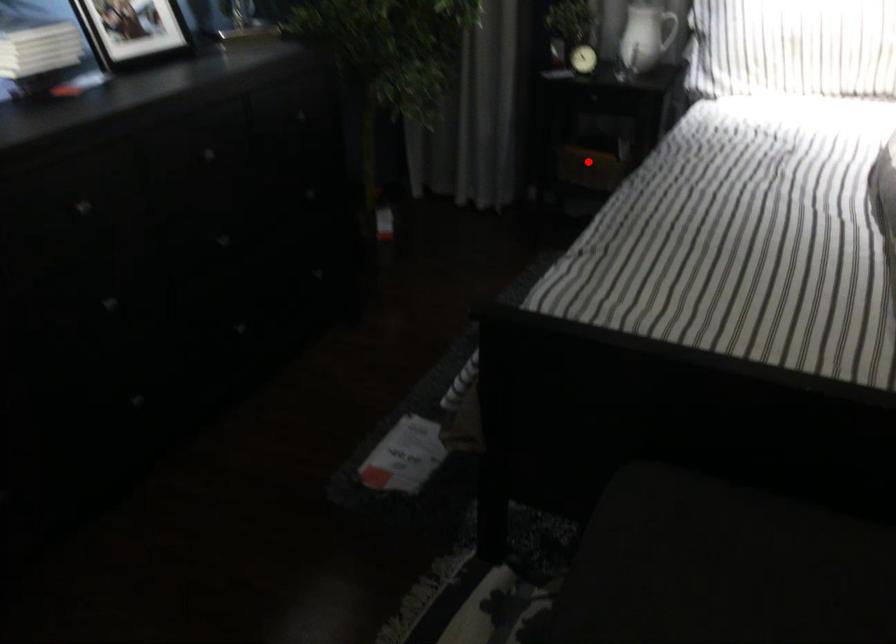
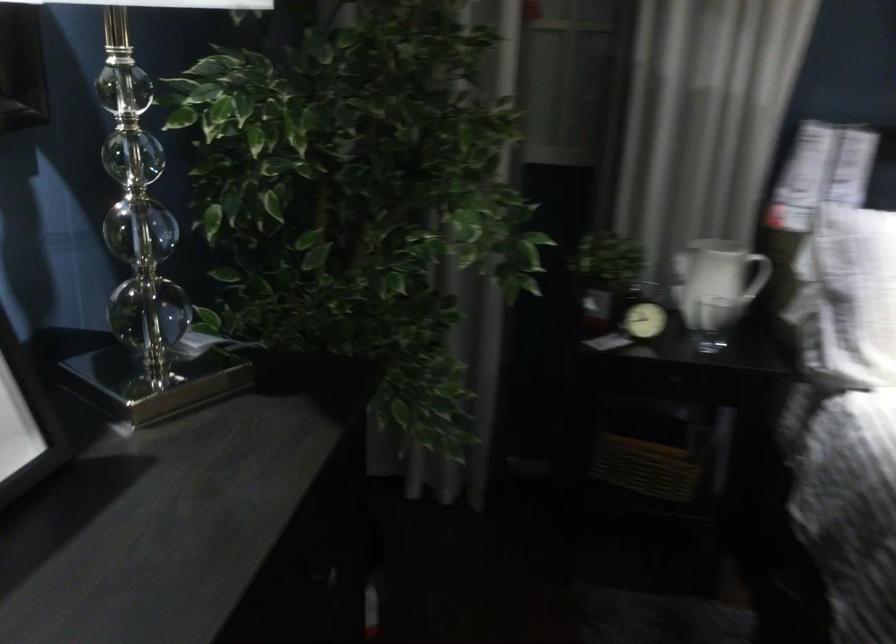
Locate, in the second image, the point that corresponds to the highlighted location in the first image.

(645, 467)